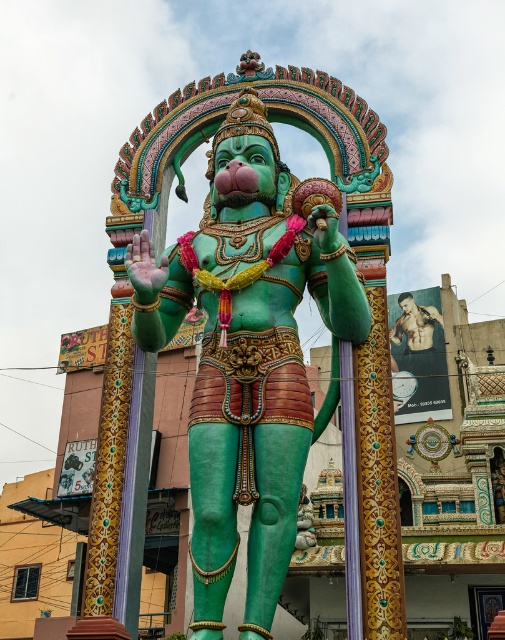
Based on the photo, is green glossy statue at center positioned at the back of muscular skin torso at right?

No, green glossy statue at center is closer to the viewer.

Which of these two, green glossy statue at center or muscular skin torso at right, stands taller?

Standing taller between the two is green glossy statue at center.

What do you see at coordinates (247, 355) in the screenshot? I see `green glossy statue at center` at bounding box center [247, 355].

What are the coordinates of `green glossy statue at center` in the screenshot? It's located at (247, 355).